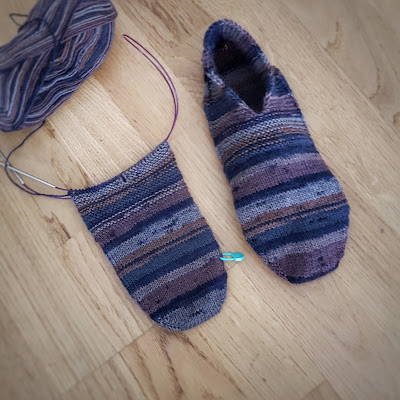
Identify the location of blonde wood in lower (my) left corner. The height and width of the screenshot is (400, 400). (56, 339).